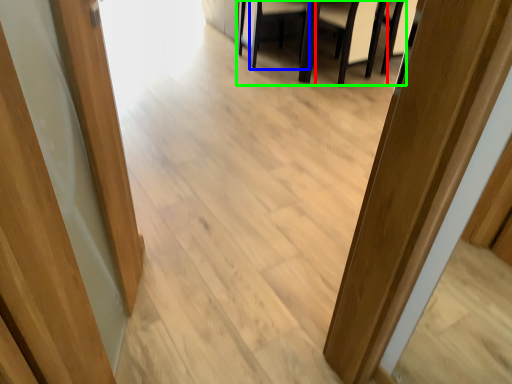
Question: Considering the real-world distances, which object is farthest from armchair (highlighted by a red box)? armchair (highlighted by a blue box) or furniture (highlighted by a green box)?

Choices:
 (A) armchair
 (B) furniture

Answer: (A)